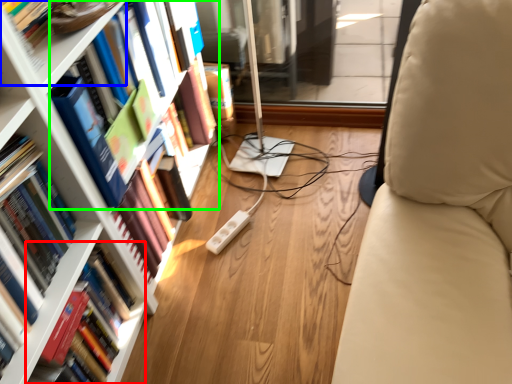
Question: Which object is the farthest from book (highlighted by a red box)? Choose among these: shelf (highlighted by a blue box) or book (highlighted by a green box).

Choices:
 (A) shelf
 (B) book

Answer: (A)